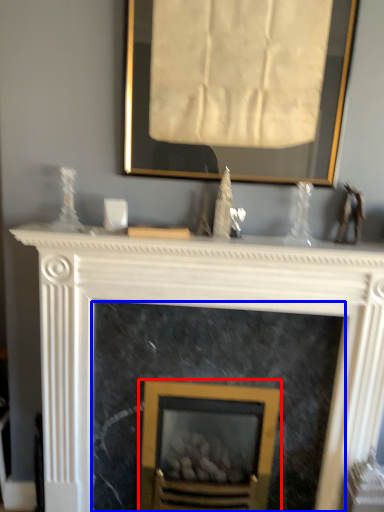
Question: Which point is closer to the camera, fireplace (highlighted by a red box) or fireplace (highlighted by a blue box)?

Choices:
 (A) fireplace
 (B) fireplace

Answer: (B)